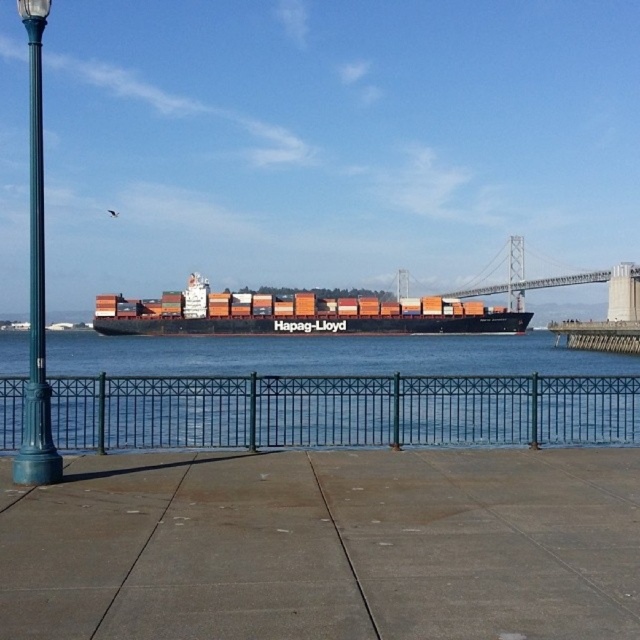
Is concrete at center taller than teal painted metal pole at left?

No.

Does concrete at center appear over teal painted metal pole at left?

No, concrete at center is not above teal painted metal pole at left.

Identify the location of concrete at center. (324, 547).

Locate an element on the screen. green metal fence at center is located at coordinates (340, 410).

Is point (637, 440) less distant than point (374, 310)?

Yes, point (637, 440) is closer to viewer.

At what (x,y) coordinates should I click in order to perform the action: click on green metal fence at center. Please return your answer as a coordinate pair (x, y). Looking at the image, I should click on (340, 410).

Does point (298, 314) come in front of point (35, 342)?

No, it is behind (35, 342).

Is orange matte container ship at center positioned behind teal painted metal pole at left?

Yes, it is.

Which is behind, point (365, 300) or point (40, 314)?

Positioned behind is point (365, 300).

The image size is (640, 640). I want to click on orange matte container ship at center, so click(x=296, y=314).